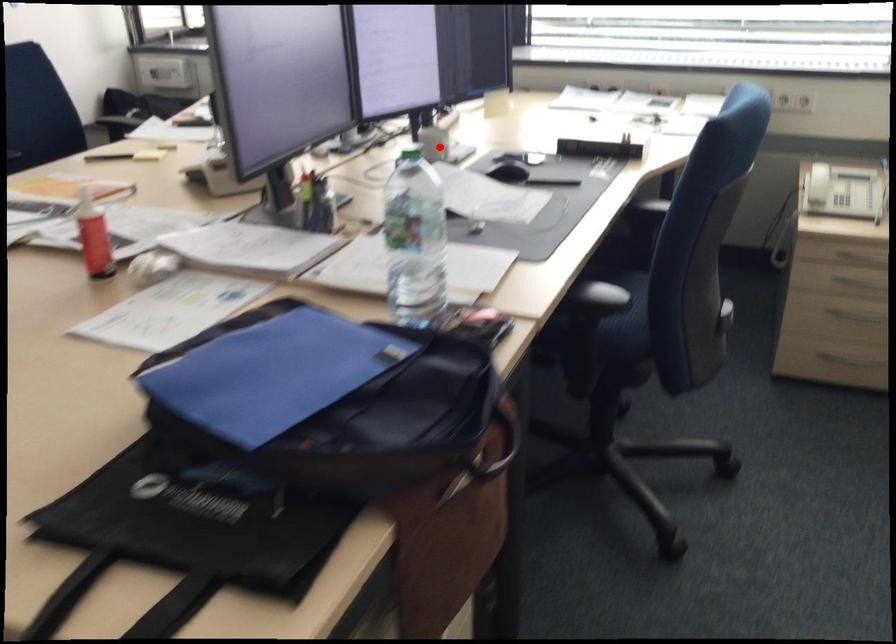
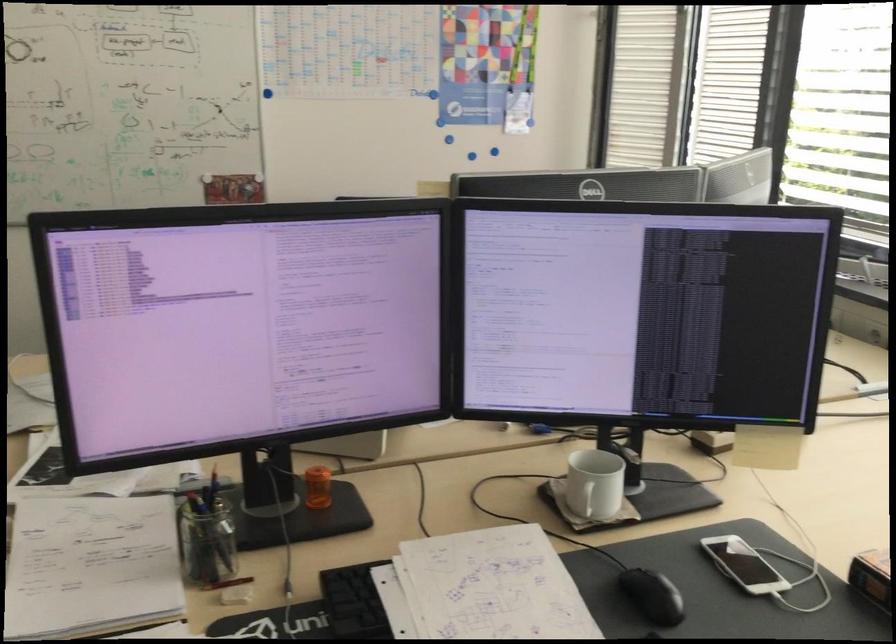
Locate, in the second image, the point that corresponds to the highlighted location in the first image.

(583, 498)